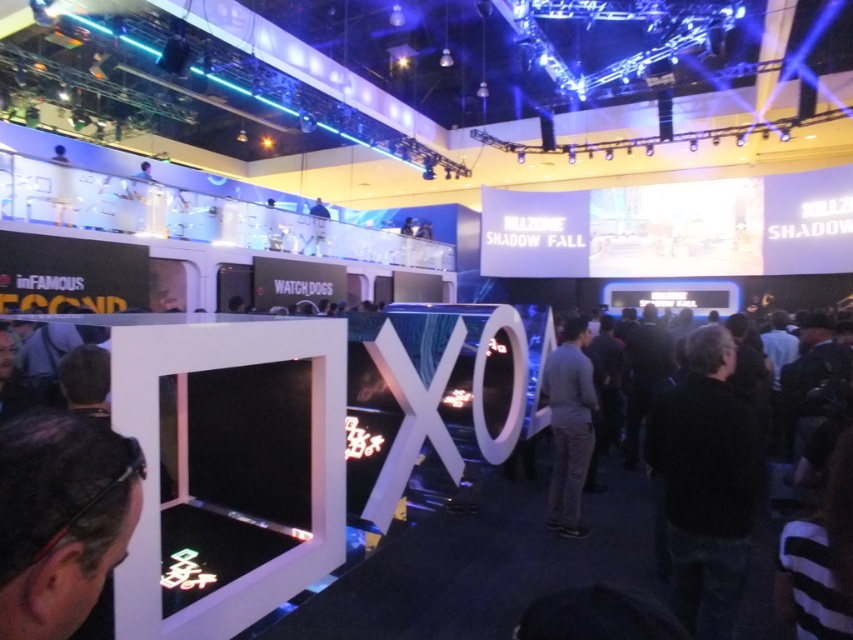
Describe the element at coordinates (705, 483) in the screenshot. Image resolution: width=853 pixels, height=640 pixels. I see `black matte jacket at lower right` at that location.

In order to click on black matte jacket at lower right in this screenshot , I will do `click(705, 483)`.

Locate an element on the screen. Image resolution: width=853 pixels, height=640 pixels. black matte jacket at lower right is located at coordinates [705, 483].

From the picture: Is black shirt at center closer to camera compared to gray fabric shirt at center?

That is True.

At what (x,y) coordinates should I click in order to perform the action: click on black shirt at center. Please return your answer as a coordinate pair (x, y). Looking at the image, I should click on coord(706,483).

In the scene shown: Who is taller, black shirt at center or black matte jacket at lower right?

With more height is black shirt at center.

Between black shirt at center and black matte jacket at lower right, which one is positioned higher?

black matte jacket at lower right is above.

Is point (672, 582) closer to viewer compared to point (654, 422)?

Yes.

Where is `black shirt at center`? The height and width of the screenshot is (640, 853). black shirt at center is located at coordinates (706, 483).